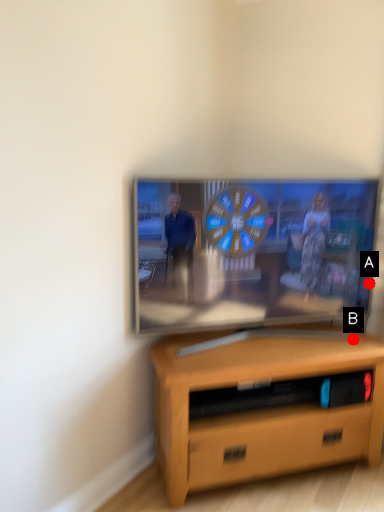
Question: Two points are circled on the image, labeled by A and B beside each circle. Among these points, which one is farthest from the camera?

Choices:
 (A) A is further
 (B) B is further

Answer: (A)